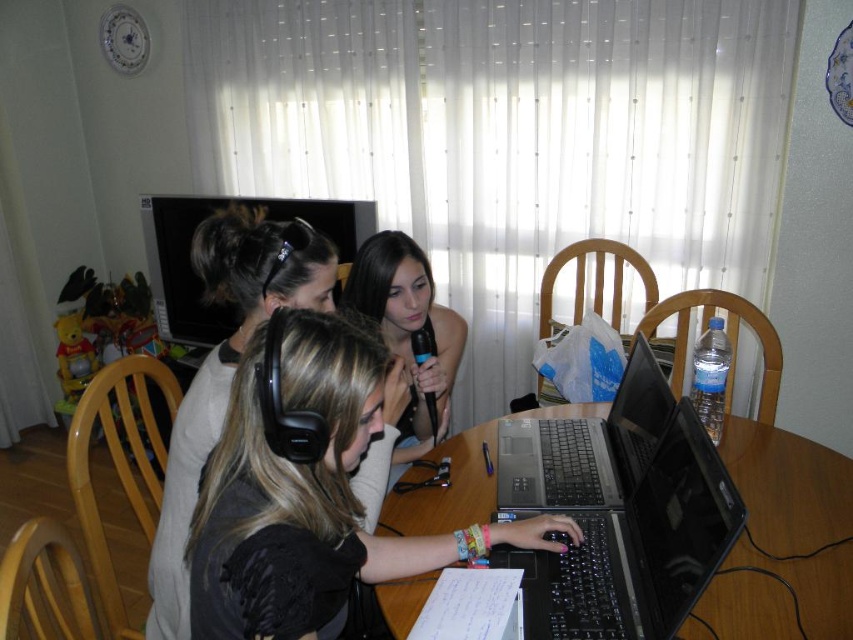
Is the position of black matte headphones at center less distant than that of smooth black microphone at center?

Yes.

Does black matte headphones at center have a lesser width compared to smooth black microphone at center?

No, black matte headphones at center is not thinner than smooth black microphone at center.

Between point (267, 525) and point (428, 294), which one is positioned in front?

Point (267, 525) is more forward.

Identify the location of black matte headphones at center. (308, 490).

Based on the photo, between black matte headphones at center and black plastic table at center, which one is positioned higher?

black matte headphones at center

Who is shorter, black matte headphones at center or black plastic table at center?

black plastic table at center is shorter.

Between point (346, 480) and point (817, 493), which one is positioned behind?

The point (817, 493) is behind.

Where is `black matte headphones at center`? The image size is (853, 640). black matte headphones at center is located at coordinates (308, 490).

Which of these two, black plastic laptop at center or smooth black microphone at center, stands shorter?

Standing shorter between the two is black plastic laptop at center.

Measure the distance from black plastic laptop at center to smooth black microphone at center.

13.29 inches

This screenshot has height=640, width=853. What do you see at coordinates (585, 445) in the screenshot? I see `black plastic laptop at center` at bounding box center [585, 445].

Where is `black plastic laptop at center`? Image resolution: width=853 pixels, height=640 pixels. black plastic laptop at center is located at coordinates pyautogui.click(x=585, y=445).